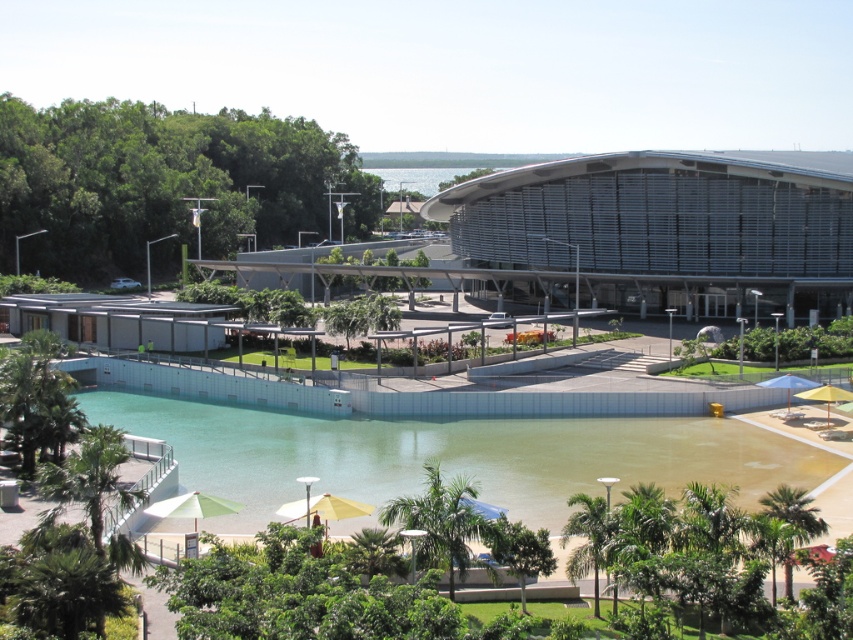
Is metallic silver building at center positioned before green leafy tree at lower left?

No, metallic silver building at center is behind green leafy tree at lower left.

Identify the location of metallic silver building at center. (668, 228).

Does green leafy tree at upper left have a greater height compared to green leafy tree at lower center?

Correct, green leafy tree at upper left is much taller as green leafy tree at lower center.

Looking at this image, can you confirm if green leafy tree at upper left is positioned to the right of green leafy tree at lower center?

No, green leafy tree at upper left is not to the right of green leafy tree at lower center.

Does point (88, 221) lie in front of point (517, 538)?

That is False.

Where is `green leafy tree at upper left`? This screenshot has height=640, width=853. green leafy tree at upper left is located at coordinates (161, 180).

I want to click on metallic silver building at center, so click(x=668, y=228).

Which is below, metallic silver building at center or green leafy palm tree at lower left?

green leafy palm tree at lower left is below.

Locate an element on the screen. The width and height of the screenshot is (853, 640). metallic silver building at center is located at coordinates (668, 228).